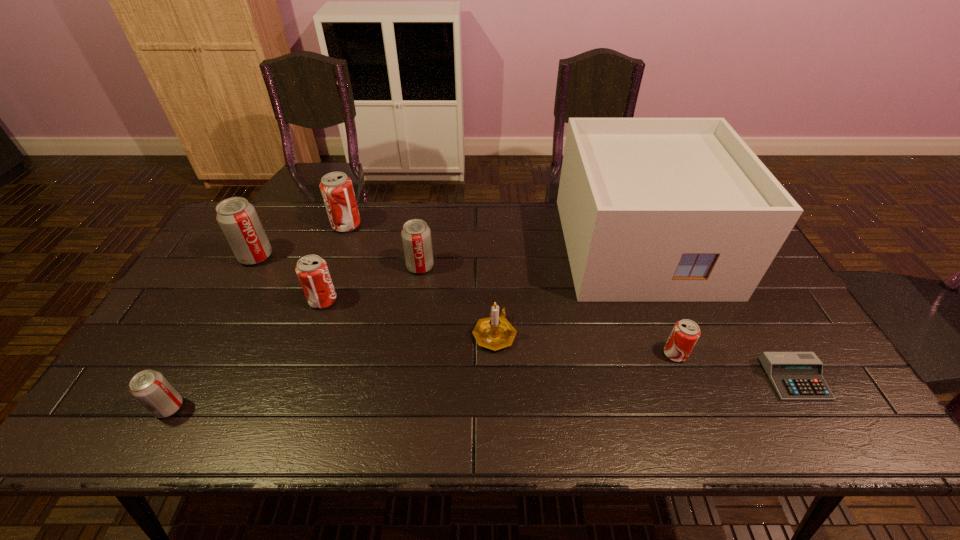
Identify the location of unoccupied position between the shortest object and the fifth object from right to left. Image resolution: width=960 pixels, height=540 pixels. (608, 322).

Image resolution: width=960 pixels, height=540 pixels. Find the location of `unoccupied area between the biggest gray soda can and the candle holder`. unoccupied area between the biggest gray soda can and the candle holder is located at coordinates (375, 295).

The image size is (960, 540). I want to click on vacant region between the second farthest pink soda can and the rightmost gray soda can, so click(x=372, y=284).

Where is `vacant area between the nearest pink soda can and the biggest gray soda can`? The width and height of the screenshot is (960, 540). vacant area between the nearest pink soda can and the biggest gray soda can is located at coordinates (466, 305).

At what (x,y) coordinates should I click in order to perform the action: click on free area in between the rightmost gray soda can and the biggest pink soda can. Please return your answer as a coordinate pair (x, y). Looking at the image, I should click on (383, 246).

Where is `free spot between the box and the sixth object from left to right`? Image resolution: width=960 pixels, height=540 pixels. free spot between the box and the sixth object from left to right is located at coordinates (567, 290).

You are a GUI agent. You are given a task and a screenshot of the screen. Output one action in this format:
    pyautogui.click(x=<x>, y=<y>)
    Task: Click on the empty space between the biggest gray soda can and the shortest object
    The image size is (960, 540).
    Given the screenshot: What is the action you would take?
    pos(525,318)

Where is `free space between the biggest gray soda can and the smallest pink soda can`? free space between the biggest gray soda can and the smallest pink soda can is located at coordinates (466, 305).

Select which object is the closest to the second smallest gray soda can. Please provide its 2D coordinates. Your answer should be formatted as a tuple, i.e. [(x, y)], where the tuple contains the x and y coordinates of a point satisfying the conditions above.

[(312, 271)]

The height and width of the screenshot is (540, 960). In order to click on object that is the seventh closest one to the rightmost gray soda can in this screenshot , I will do `click(685, 333)`.